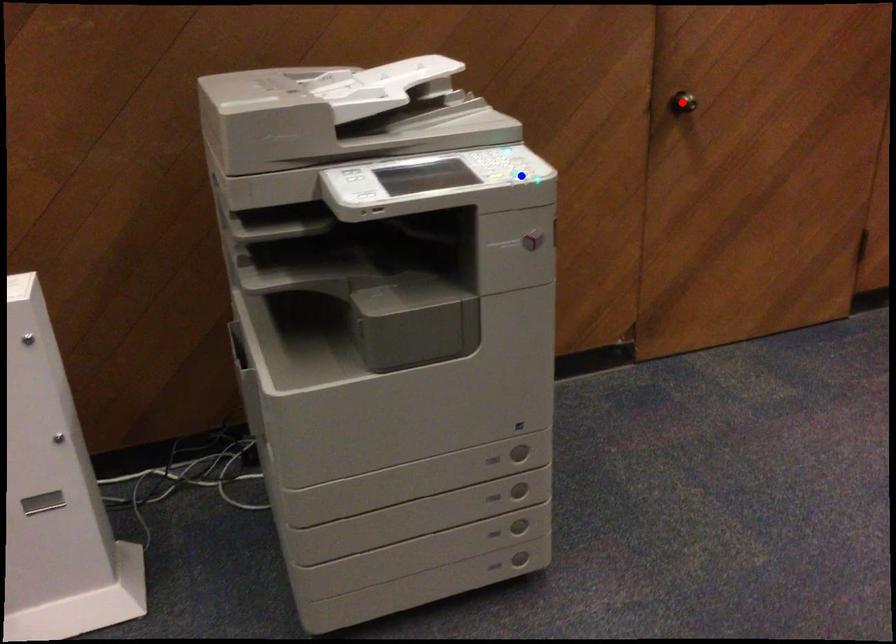
Question: Two points are marked on the image. Which point is closer to the camera?

Choices:
 (A) Blue point is closer.
 (B) Red point is closer.

Answer: (A)